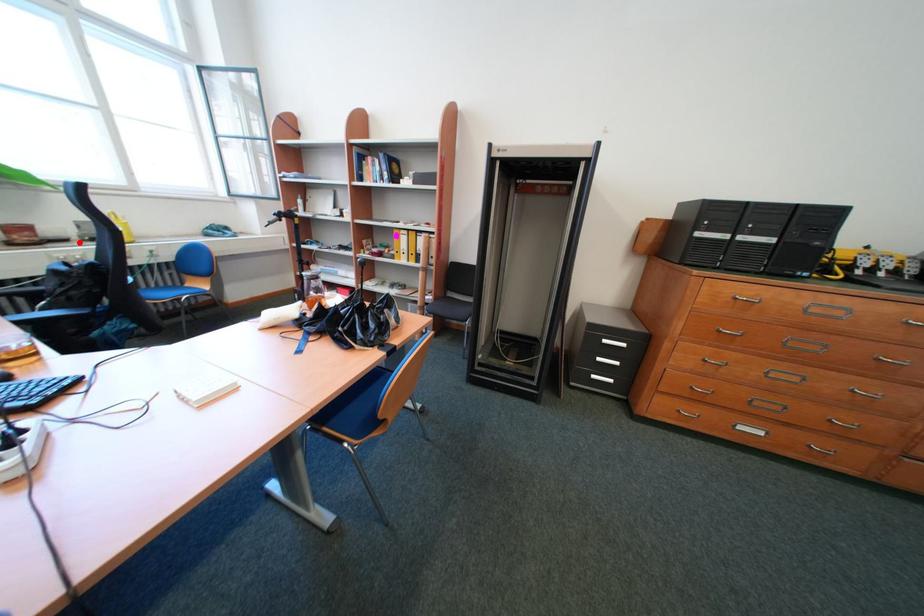
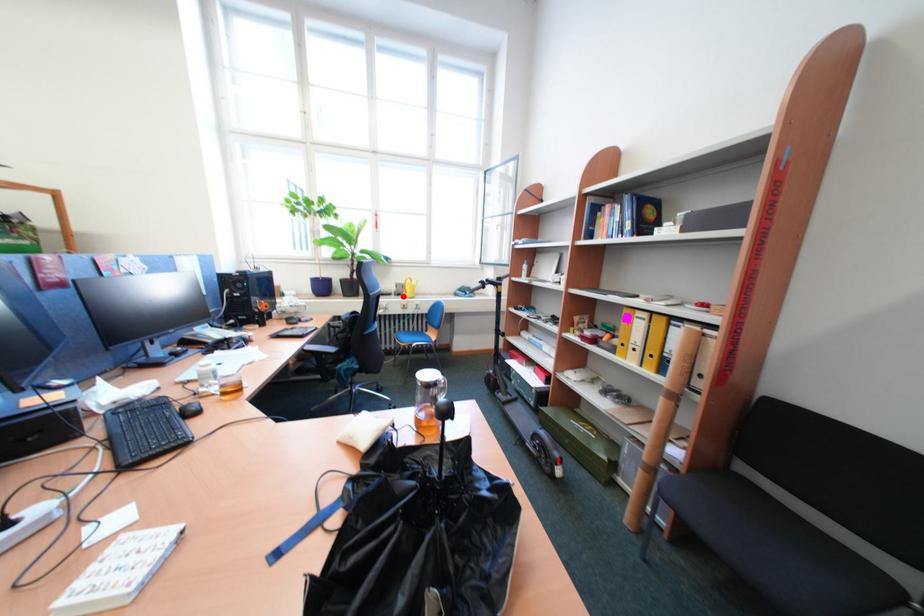
I am providing you with two images of the same scene from different viewpoints. A red point is marked on the first image and another point is marked on the second image. Is the red point in image1 aligned with the point shown in image2?

Yes